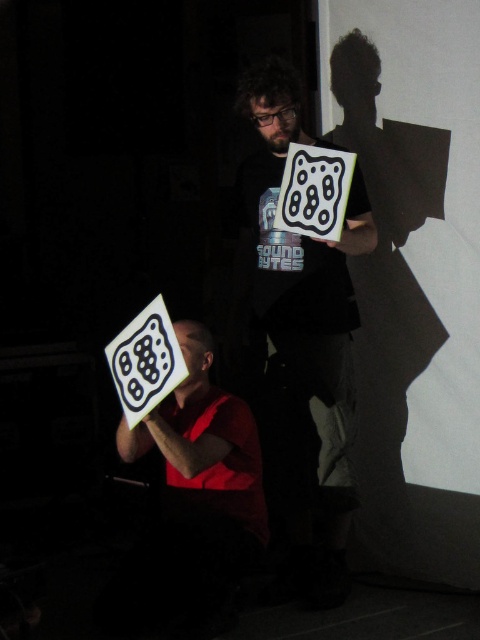
You are an event planner setting up for a presentation. You need to place a projector screen exactly at the center of the room. The white matte sign at center is currently positioned at coordinates point 0.583, 0.627. Is the sign correctly placed for the projector screen?

The white matte sign at center is located at point (300, 372), so if the center of the room corresponds to those coordinates, then yes, the sign is correctly placed. Otherwise, it may need adjustment based on the room dimensions.

You are a stagehand in a dimly lit indoor venue where a performance is taking place. You need to locate the white glossy square at lower left. According to the coordinates provided, where exactly should you look to find it?

The white glossy square at lower left is located at point (144,362).

You are a stagehand who needs to adjust the lighting for the performance. The spotlight has a maximum range of 18 inches. Can you illuminate both the white matte sign at center and the matte black face at center simultaneously without moving the spotlight?

The distance between the white matte sign at center and the matte black face at center is 18.31 inches, which exceeds the spotlight maximum range of 18 inches. Therefore, you cannot illuminate both simultaneously without moving the spotlight.